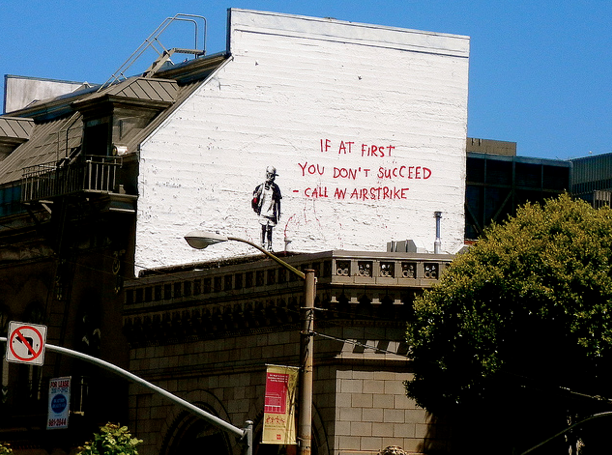
Where is `painting`? The image size is (612, 455). painting is located at coordinates (271, 182).